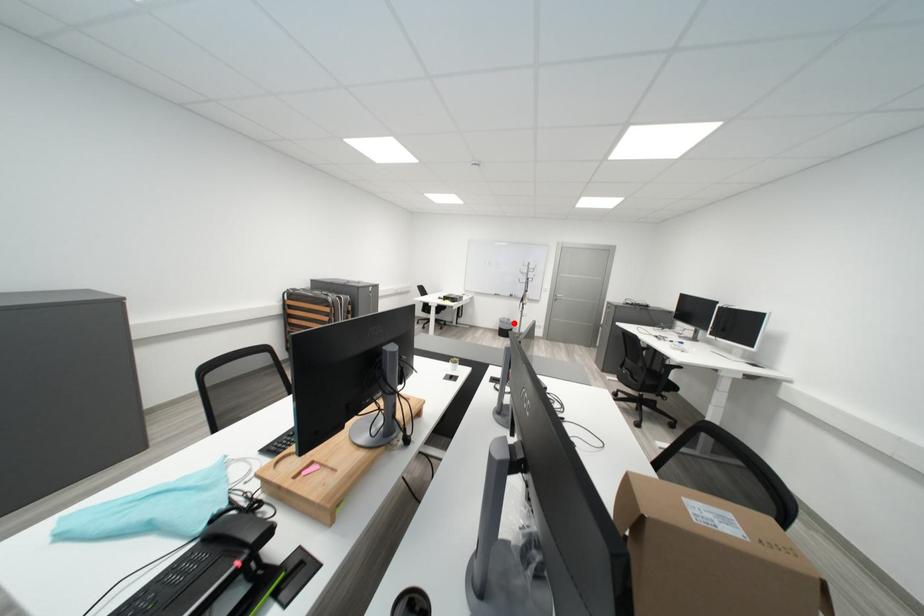
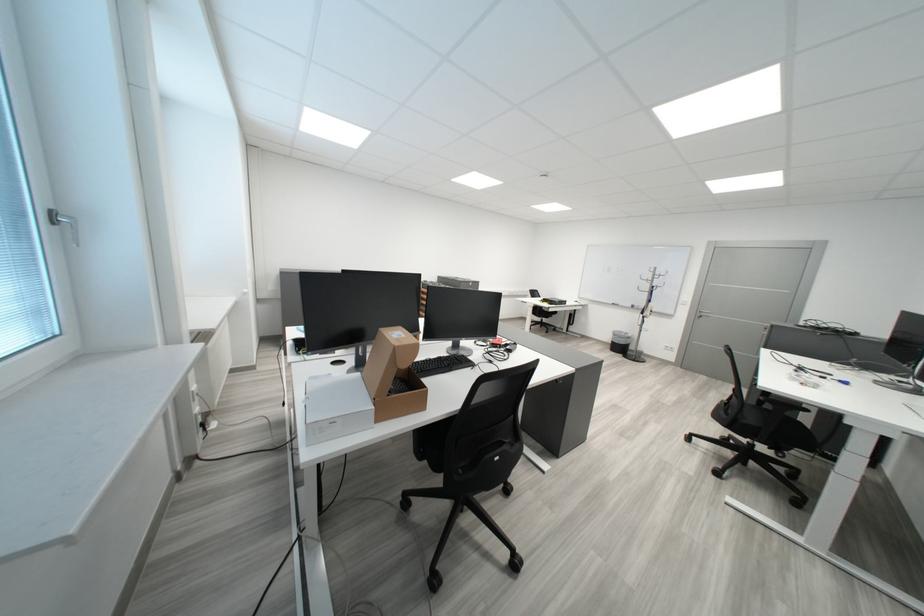
The point at the highlighted location is marked in the first image. Where is the corresponding point in the second image?

(627, 336)